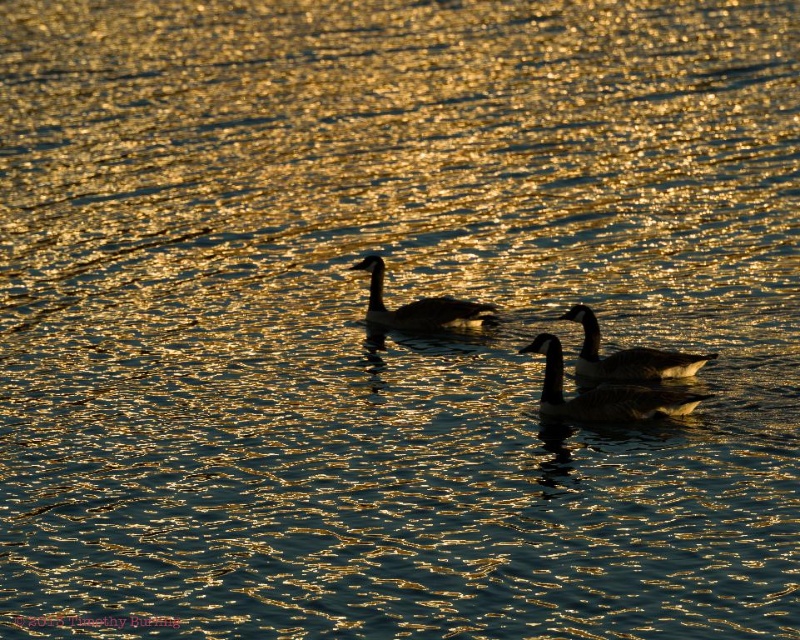
Between point (680, 355) and point (366, 268), which one is positioned behind?

Point (366, 268)

Does point (664, 369) lie behind point (448, 301)?

No, it is in front of (448, 301).

At what (x,y) coordinates should I click in order to perform the action: click on dark brown feathers at center. Please return your answer as a coordinate pair (x, y). Looking at the image, I should click on (628, 356).

Can you confirm if dark gray feathers at center is shorter than dark brown feathers at center?

No, dark gray feathers at center is not shorter than dark brown feathers at center.

Which is in front, point (658, 397) or point (616, 368)?

Point (658, 397)

Locate an element on the screen. This screenshot has height=640, width=800. dark gray feathers at center is located at coordinates (604, 394).

Does dark gray feathers at center appear on the right side of silhouette glossy duck at center?

Indeed, dark gray feathers at center is positioned on the right side of silhouette glossy duck at center.

This screenshot has height=640, width=800. I want to click on dark gray feathers at center, so click(x=604, y=394).

Locate an element on the screen. dark gray feathers at center is located at coordinates (604, 394).